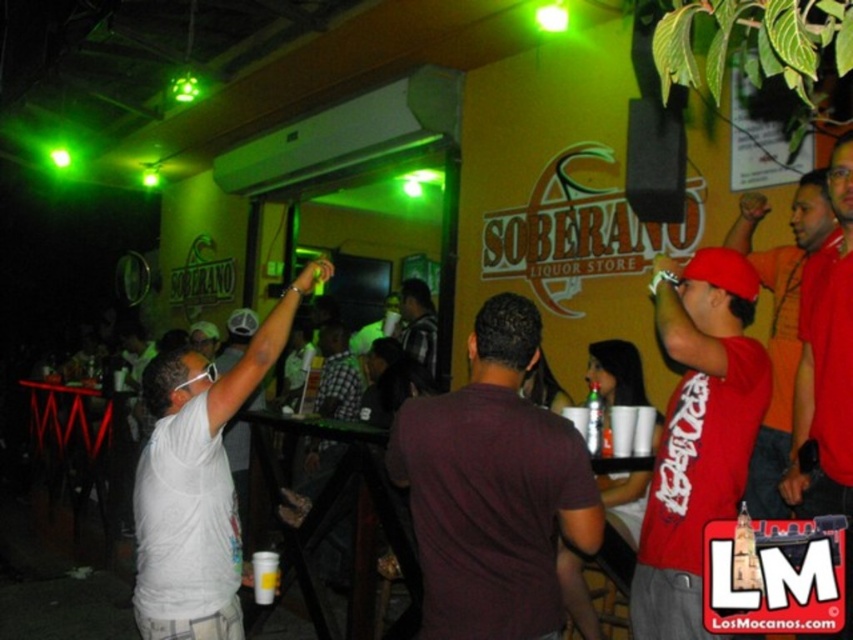
Between red matte baseball cap at center and plaid fabric shirt at center, which one is positioned lower?

Positioned lower is plaid fabric shirt at center.

Does red matte baseball cap at center appear over plaid fabric shirt at center?

Yes.

Image resolution: width=853 pixels, height=640 pixels. Find the location of `red matte baseball cap at center`. red matte baseball cap at center is located at coordinates [780, 323].

Does plaid fabric shirt at center have a greater height compared to yellow paper cup at center?

Yes.

The image size is (853, 640). In order to click on plaid fabric shirt at center in this screenshot , I will do [x=418, y=323].

Which is behind, point (419, 280) or point (263, 582)?

The point (419, 280) is more distant.

Find the location of `plaid fabric shirt at center`. plaid fabric shirt at center is located at coordinates (418, 323).

Which is behind, point (700, 634) or point (254, 580)?

Point (254, 580)

Which of these two, red matte shirt at center or yellow paper cup at center, stands shorter?

yellow paper cup at center

The width and height of the screenshot is (853, 640). Find the location of `red matte shirt at center`. red matte shirt at center is located at coordinates (697, 433).